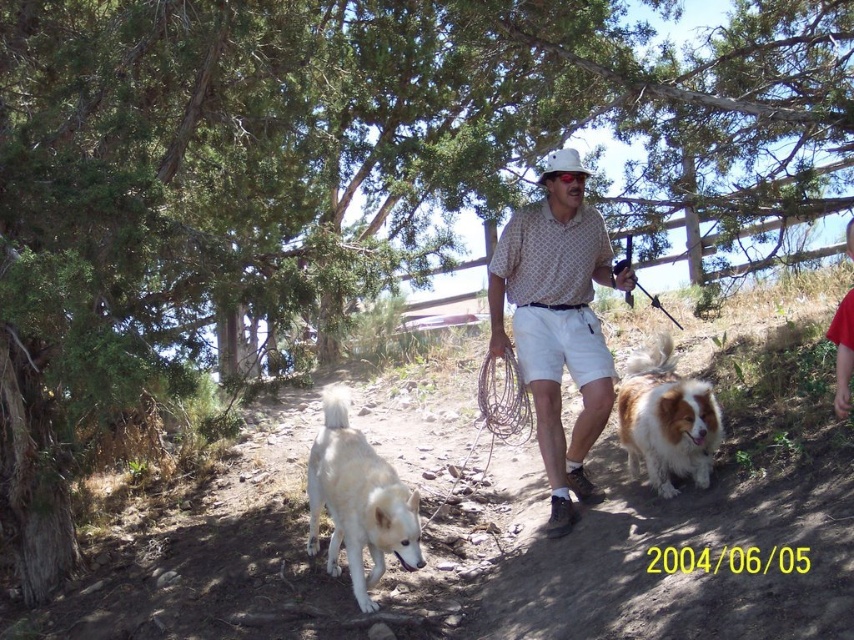
Based on the scene description, where is the polka dot shirt at center located in terms of coordinates?

The polka dot shirt at center is located at coordinates point (559, 321).

In the scene shown: You are a photographer standing at the edge of the dirt path in the forest. You want to take a photo that includes both the point at coordinates point (553, 364) and point (351, 484). Which point should you focus on first to ensure both are in focus?

You should focus on point (553, 364) first because it is closer to the camera than point (351, 484). This ensures that both points will be in focus when using a camera with a limited depth of field.

You are a hiker walking along the dirt path in the forest. You see a polka dot shirt at center and a white fur dog at lower left. Which object is closer to you?

The polka dot shirt at center is closer to you because it is further to the viewer than the white fur dog at lower left.